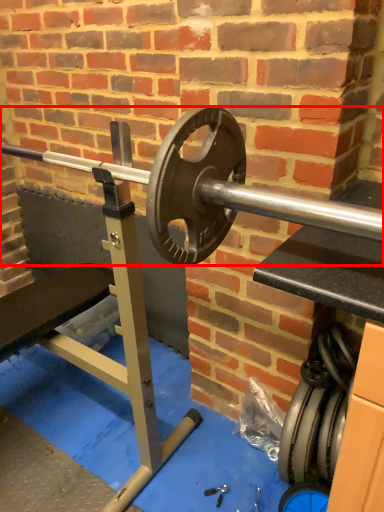
Question: From the image's perspective, where is barbell (annotated by the red box) located relative to tire?

Choices:
 (A) below
 (B) above

Answer: (B)